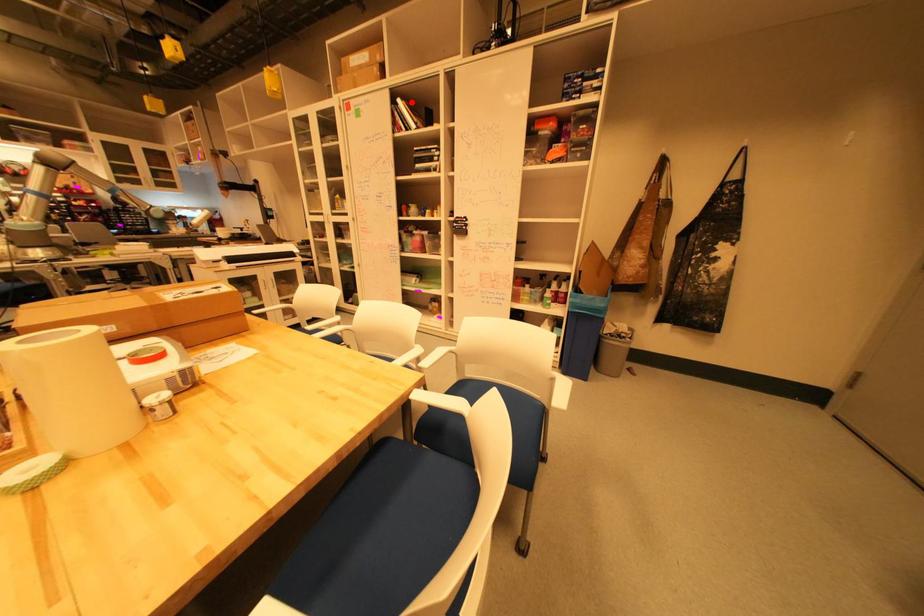
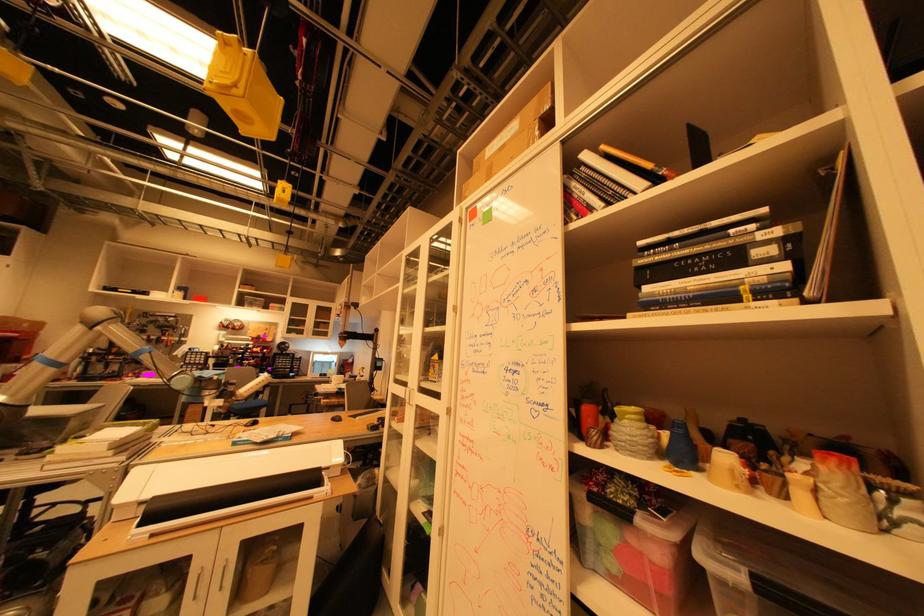
Question: I am providing you with two images of the same scene from different viewpoints. Given a red point in image1, look at the same physical point in image2. Is it:

Choices:
 (A) Closer to the viewpoint
 (B) Farther from the viewpoint

Answer: (B)